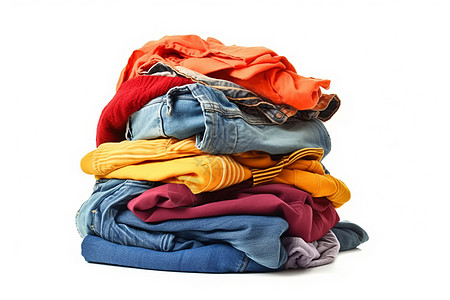
Where is `clothes in pile`? clothes in pile is located at coordinates (216, 51), (137, 87), (192, 108), (182, 149), (162, 196), (114, 221), (321, 249), (236, 259), (84, 212).